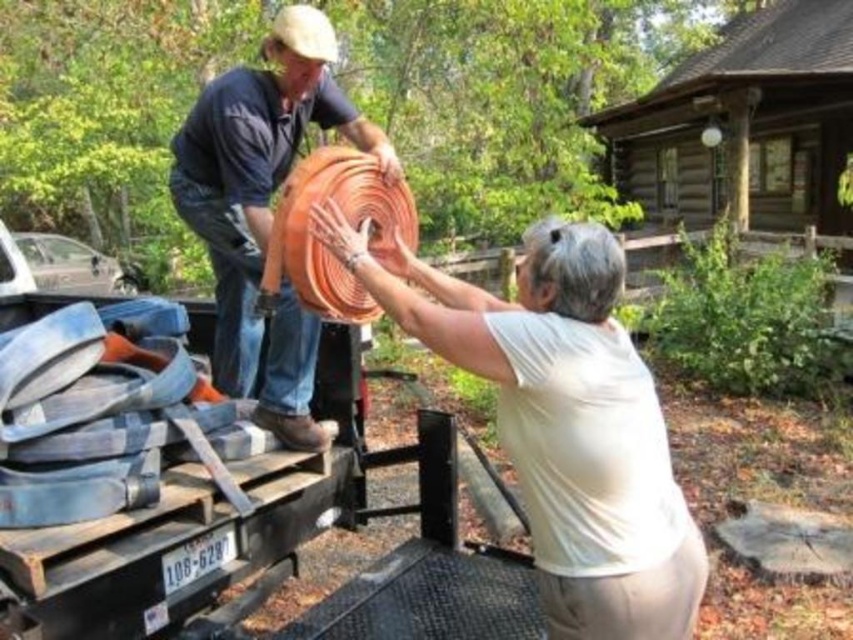
In the scene shown: You are a delivery person who needs to place a 2.5 meter long package between the brown wooden log cabin at upper center and the orange rubber hose at center. Can you fit the package horizontally between them?

The brown wooden log cabin at upper center is taller than the orange rubber hose at center, but the height difference does not affect the horizontal space between them. The question about fitting a 2.5 meter long package horizontally requires knowing the horizontal distance between the objects, which is not provided in the objects description. Therefore, it cannot be determined if the package will fit.

You are standing in the residential area where the brown wooden log cabin at upper center and the orange rubber hose at center are visible. Which object is positioned to the right side from your perspective?

The brown wooden log cabin at upper center is to the right of the orange rubber hose at center, so the brown wooden log cabin at upper center is positioned to the right side from your perspective.

You are planning to deliver a package to the brown wooden log cabin at upper center and the orange rubber hose at center. Which destination requires a larger delivery vehicle based on their sizes?

The brown wooden log cabin at upper center requires a larger delivery vehicle because it is larger in size than the orange rubber hose at center.